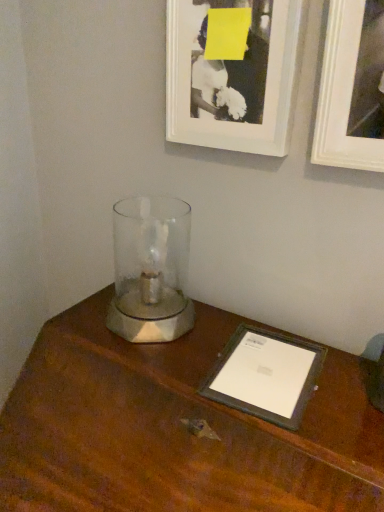
Question: Is white matte picture frame at upper right, the 1th picture frame in the right-to-left sequence, with brown wood table at center?

Choices:
 (A) no
 (B) yes

Answer: (A)

Question: Is the position of white matte picture frame at upper right, acting as the 2th picture frame starting from the left, more distant than that of brown wood table at center?

Choices:
 (A) no
 (B) yes

Answer: (B)

Question: Could you tell me if white matte picture frame at upper right, the 1th picture frame in the right-to-left sequence, is facing brown wood table at center?

Choices:
 (A) no
 (B) yes

Answer: (A)

Question: Can you confirm if white matte picture frame at upper right, acting as the 2th picture frame starting from the left, is wider than brown wood table at center?

Choices:
 (A) no
 (B) yes

Answer: (A)

Question: From a real-world perspective, relative to white matte picture frame at upper right, the 1th picture frame in the right-to-left sequence, is brown wood table at center vertically above or below?

Choices:
 (A) below
 (B) above

Answer: (A)

Question: Is brown wood table at center to the left or to the right of white matte picture frame at upper right, the 1th picture frame in the right-to-left sequence, in the image?

Choices:
 (A) right
 (B) left

Answer: (B)

Question: Considering the positions of brown wood table at center and white matte picture frame at upper right, acting as the 2th picture frame starting from the left, in the image, is brown wood table at center wider or thinner than white matte picture frame at upper right, acting as the 2th picture frame starting from the left,?

Choices:
 (A) wide
 (B) thin

Answer: (A)

Question: Considering the positions of brown wood table at center and white matte picture frame at upper right, the 1th picture frame in the right-to-left sequence, in the image, is brown wood table at center taller or shorter than white matte picture frame at upper right, the 1th picture frame in the right-to-left sequence,?

Choices:
 (A) short
 (B) tall

Answer: (B)

Question: Considering the positions of point 365,67 and point 205,73, is point 365,67 closer or farther from the camera than point 205,73?

Choices:
 (A) closer
 (B) farther

Answer: (A)

Question: Considering the positions of white matte picture frame at upper right, the 1th picture frame in the right-to-left sequence, and black matte picture frame at upper center, placed as the 2th picture frame when sorted from right to left, in the image, is white matte picture frame at upper right, the 1th picture frame in the right-to-left sequence, wider or thinner than black matte picture frame at upper center, placed as the 2th picture frame when sorted from right to left,?

Choices:
 (A) thin
 (B) wide

Answer: (B)

Question: Considering the relative positions of white matte picture frame at upper right, acting as the 2th picture frame starting from the left, and black matte picture frame at upper center, placed as the 2th picture frame when sorted from right to left, in the image provided, is white matte picture frame at upper right, acting as the 2th picture frame starting from the left, to the left or to the right of black matte picture frame at upper center, placed as the 2th picture frame when sorted from right to left,?

Choices:
 (A) left
 (B) right

Answer: (B)

Question: From the image's perspective, is white matte picture frame at upper right, the 1th picture frame in the right-to-left sequence, positioned above or below black matte picture frame at upper center, the 1th picture frame viewed from the left?

Choices:
 (A) below
 (B) above

Answer: (A)

Question: Relative to brown wood table at center, is black matte picture frame at upper center, placed as the 2th picture frame when sorted from right to left, in front or behind?

Choices:
 (A) behind
 (B) front

Answer: (A)

Question: Considering the positions of black matte picture frame at upper center, the 1th picture frame viewed from the left, and brown wood table at center in the image, is black matte picture frame at upper center, the 1th picture frame viewed from the left, taller or shorter than brown wood table at center?

Choices:
 (A) short
 (B) tall

Answer: (A)